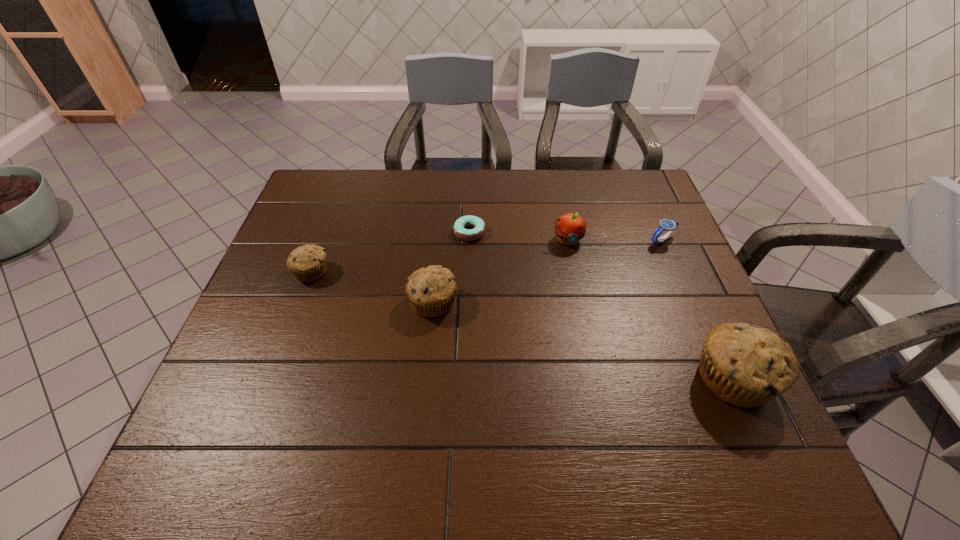
Locate an element on the screen. This screenshot has height=540, width=960. free region located 0.210m on the back of the tallest object is located at coordinates (688, 279).

Find the location of a particular element. vacant space located on the back of the fourth object from left to right is located at coordinates (559, 198).

Locate an element on the screen. blank area located on the left of the shortest object is located at coordinates (419, 232).

Find the location of a particular element. vacant space positioned 0.100m on the front of the watch is located at coordinates (677, 274).

Find the location of a particular element. object that is at the near edge is located at coordinates [745, 365].

You are a GUI agent. You are given a task and a screenshot of the screen. Output one action in this format:
    pyautogui.click(x=<x>, y=<y>)
    Task: Click on the object located at the left edge
    The height and width of the screenshot is (540, 960).
    Given the screenshot: What is the action you would take?
    pyautogui.click(x=308, y=263)

Where is `muffin that is at the right edge`? muffin that is at the right edge is located at coordinates (745, 365).

Where is `watch situated at the right edge`? The image size is (960, 540). watch situated at the right edge is located at coordinates (671, 226).

This screenshot has height=540, width=960. I want to click on object that is at the near right corner, so click(x=745, y=365).

In the image, there is a desktop. At what (x,y) coordinates should I click in order to perform the action: click on vacant space at the far edge. Please return your answer as a coordinate pair (x, y). The width and height of the screenshot is (960, 540). Looking at the image, I should click on (503, 170).